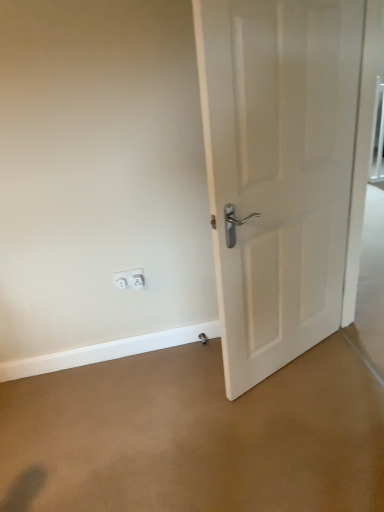
Question: Relative to white plastic electric outlet at lower left, the 2th electric outlet viewed from the right, is brown carpet at center in front or behind?

Choices:
 (A) behind
 (B) front

Answer: (B)

Question: Is brown carpet at center inside the boundaries of white plastic electric outlet at lower left, the 2th electric outlet viewed from the right, or outside?

Choices:
 (A) outside
 (B) inside

Answer: (A)

Question: Which of these objects is positioned farthest from the white plastic electric outlet at lower left, placed as the 2th electric outlet when sorted from left to right?

Choices:
 (A) brown carpet at center
 (B) white matte door at right
 (C) white plastic electric outlet at lower left, the 2th electric outlet viewed from the right

Answer: (B)

Question: Considering the real-world distances, which object is closest to the white matte door at right?

Choices:
 (A) white plastic electric outlet at lower left, arranged as the 1th electric outlet when viewed from the left
 (B) white plastic electric outlet at lower left, the 1th electric outlet from the right
 (C) brown carpet at center

Answer: (C)